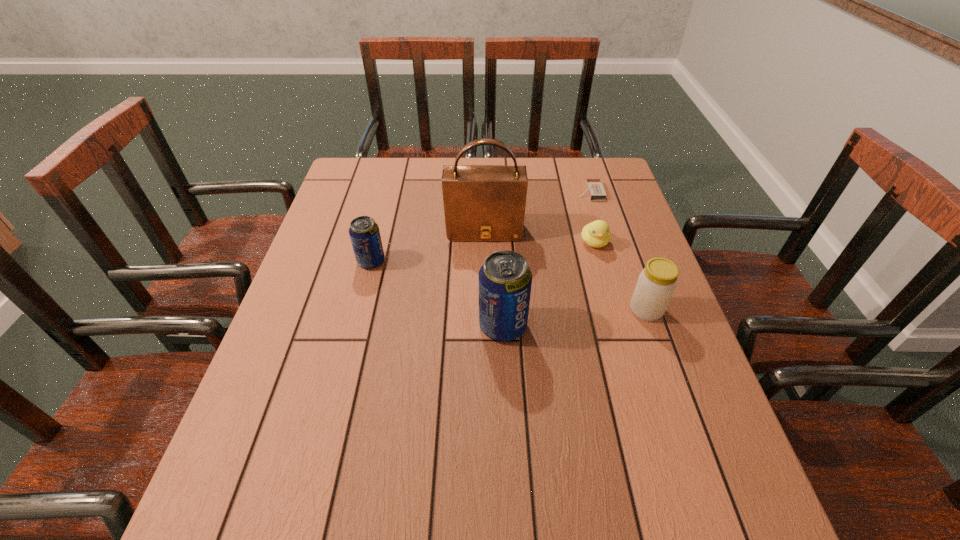
Find the location of `object that stands as the fifth closest to the left soda`. object that stands as the fifth closest to the left soda is located at coordinates (656, 284).

Identify the location of vacant area in the image that satisfies the following two spatial constraints: 1. on the striking surface of the farthest object; 2. at the beak of the second shortest object. (606, 242).

Where is `vacant space that satisfies the following two spatial constraints: 1. on the striking surface of the shortest object; 2. on the front side of the shorter soda`? The image size is (960, 540). vacant space that satisfies the following two spatial constraints: 1. on the striking surface of the shortest object; 2. on the front side of the shorter soda is located at coordinates [612, 262].

Image resolution: width=960 pixels, height=540 pixels. Find the location of `free space that satisfies the following two spatial constraints: 1. on the striking surface of the matchbox; 2. at the beak of the fifth tallest object`. free space that satisfies the following two spatial constraints: 1. on the striking surface of the matchbox; 2. at the beak of the fifth tallest object is located at coordinates (606, 242).

Find the location of `vacant region that satisfies the following two spatial constraints: 1. on the front side of the fifth shortest object; 2. on the right side of the leftmost object`. vacant region that satisfies the following two spatial constraints: 1. on the front side of the fifth shortest object; 2. on the right side of the leftmost object is located at coordinates (355, 326).

Locate an element on the screen. free spot that satisfies the following two spatial constraints: 1. on the front flap of the tallest object; 2. on the left side of the jar is located at coordinates (485, 310).